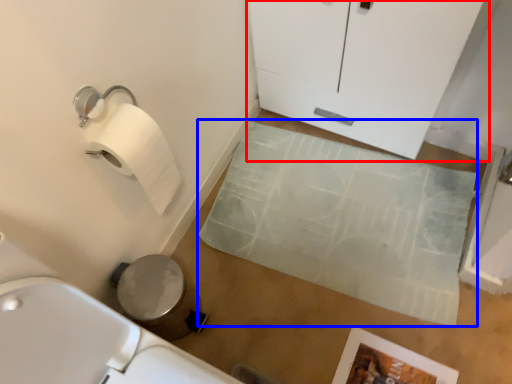
Question: Among these objects, which one is nearest to the camera, glass door (highlighted by a red box) or bath mat (highlighted by a blue box)?

Choices:
 (A) glass door
 (B) bath mat

Answer: (A)